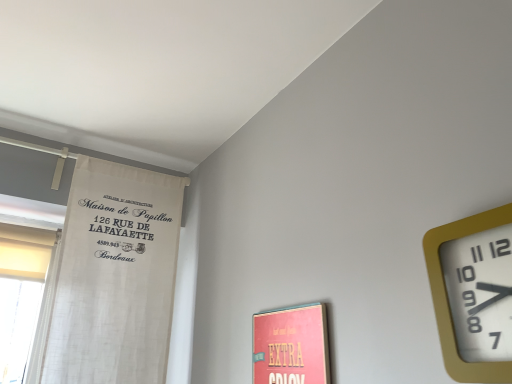
Describe the element at coordinates (473, 294) in the screenshot. I see `gold plastic wall clock at upper right` at that location.

Where is `gold plastic wall clock at upper right`? The width and height of the screenshot is (512, 384). gold plastic wall clock at upper right is located at coordinates (473, 294).

What do you see at coordinates (113, 277) in the screenshot?
I see `white fabric curtain at left` at bounding box center [113, 277].

You are a GUI agent. You are given a task and a screenshot of the screen. Output one action in this format:
    pyautogui.click(x=<x>, y=<y>)
    Task: Click on the white fabric curtain at left
    
    Given the screenshot: What is the action you would take?
    pyautogui.click(x=113, y=277)

Find the location of `gold plastic wall clock at upper right`. gold plastic wall clock at upper right is located at coordinates coord(473,294).

Looking at this image, between white fabric curtain at left and gold plastic wall clock at upper right, which one appears on the left side from the viewer's perspective?

Positioned to the left is white fabric curtain at left.

Which object is more forward, white fabric curtain at left or gold plastic wall clock at upper right?

gold plastic wall clock at upper right is closer to the camera.

Is point (169, 289) in front of point (457, 286)?

No.

Looking at this image, from the image's perspective, is white fabric curtain at left on gold plastic wall clock at upper right?

No, from the image's perspective, white fabric curtain at left is not over gold plastic wall clock at upper right.

From a real-world perspective, who is located lower, white fabric curtain at left or gold plastic wall clock at upper right?

In real-world perspective, gold plastic wall clock at upper right is lower.

Between white fabric curtain at left and gold plastic wall clock at upper right, which one has larger width?

Wider between the two is white fabric curtain at left.

From the picture: Can you confirm if white fabric curtain at left is taller than gold plastic wall clock at upper right?

Indeed, white fabric curtain at left has a greater height compared to gold plastic wall clock at upper right.

Which of these two, white fabric curtain at left or gold plastic wall clock at upper right, is bigger?

Bigger between the two is white fabric curtain at left.

Would you say white fabric curtain at left contains gold plastic wall clock at upper right?

No, gold plastic wall clock at upper right is not surrounded by white fabric curtain at left.

Is white fabric curtain at left with gold plastic wall clock at upper right?

white fabric curtain at left is not next to gold plastic wall clock at upper right, and they're not touching.

Does white fabric curtain at left turn towards gold plastic wall clock at upper right?

Yes, white fabric curtain at left is aimed at gold plastic wall clock at upper right.

How many degrees apart are the facing directions of white fabric curtain at left and gold plastic wall clock at upper right?

The facing directions of white fabric curtain at left and gold plastic wall clock at upper right are 90.3 degrees apart.

Measure the distance between white fabric curtain at left and gold plastic wall clock at upper right.

white fabric curtain at left and gold plastic wall clock at upper right are 3.83 feet apart from each other.

Locate an element on the screen. wall clock located above the white fabric curtain at left (from the image's perspective) is located at coordinates (473, 294).

Consider the image. Is gold plastic wall clock at upper right at the left side of white fabric curtain at left?

No, gold plastic wall clock at upper right is not to the left of white fabric curtain at left.

Relative to white fabric curtain at left, is gold plastic wall clock at upper right in front or behind?

Visually, gold plastic wall clock at upper right is located in front of white fabric curtain at left.

Does point (473, 228) appear closer or farther from the camera than point (165, 332)?

Point (473, 228) is closer to the camera than point (165, 332).

From the image's perspective, is gold plastic wall clock at upper right located beneath white fabric curtain at left?

Incorrect, from the image's perspective, gold plastic wall clock at upper right is higher than white fabric curtain at left.

From a real-world perspective, is gold plastic wall clock at upper right below white fabric curtain at left?

Yes.

In terms of width, does gold plastic wall clock at upper right look wider or thinner when compared to white fabric curtain at left?

In the image, gold plastic wall clock at upper right appears to be more narrow than white fabric curtain at left.

Considering the relative sizes of gold plastic wall clock at upper right and white fabric curtain at left in the image provided, is gold plastic wall clock at upper right shorter than white fabric curtain at left?

Correct, gold plastic wall clock at upper right is not as tall as white fabric curtain at left.

Considering the sizes of gold plastic wall clock at upper right and white fabric curtain at left in the image, is gold plastic wall clock at upper right bigger or smaller than white fabric curtain at left?

In the image, gold plastic wall clock at upper right appears to be smaller than white fabric curtain at left.

Choose the correct answer: Is gold plastic wall clock at upper right inside white fabric curtain at left or outside it?

gold plastic wall clock at upper right is located beyond the bounds of white fabric curtain at left.

Is gold plastic wall clock at upper right beside white fabric curtain at left?

No, gold plastic wall clock at upper right is not in contact with white fabric curtain at left.

Does gold plastic wall clock at upper right turn towards white fabric curtain at left?

No, gold plastic wall clock at upper right does not turn towards white fabric curtain at left.

Locate an element on the screen. wall clock that is above the white fabric curtain at left (from the image's perspective) is located at coordinates (473, 294).

At what (x,y) coordinates should I click in order to perform the action: click on curtain above the gold plastic wall clock at upper right (from a real-world perspective). Please return your answer as a coordinate pair (x, y). The width and height of the screenshot is (512, 384). Looking at the image, I should click on (113, 277).

Where is `wall clock that appears above the white fabric curtain at left (from the image's perspective)`? This screenshot has height=384, width=512. wall clock that appears above the white fabric curtain at left (from the image's perspective) is located at coordinates (473, 294).